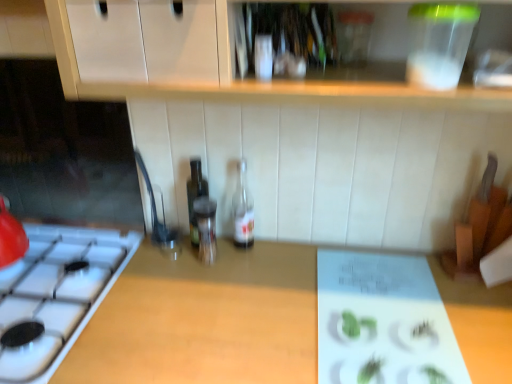
What do you see at coordinates (206, 228) in the screenshot? The image size is (512, 384). I see `transparent glass bottle at center, the 2th bottle positioned from the right` at bounding box center [206, 228].

The height and width of the screenshot is (384, 512). What do you see at coordinates (195, 196) in the screenshot?
I see `translucent glass bottle at center, the third bottle in the right-to-left sequence` at bounding box center [195, 196].

Locate an element on the screen. The height and width of the screenshot is (384, 512). transparent glass bottle at center, which is the 2th bottle from left to right is located at coordinates (206, 228).

In the scene shown: Can you confirm if transparent glass bottle at center, the 2th bottle positioned from the right, is positioned to the left of translucent glass bottle at center, arranged as the 1th bottle when viewed from the left?

In fact, transparent glass bottle at center, the 2th bottle positioned from the right, is to the right of translucent glass bottle at center, arranged as the 1th bottle when viewed from the left.

Which bottle is the 1st one when counting from the right side of the translucent glass bottle at center, arranged as the 1th bottle when viewed from the left? Please provide its 2D coordinates.

[(206, 228)]

Considering the relative sizes of transparent glass bottle at center, which is the 2th bottle from left to right, and translucent glass bottle at center, the third bottle in the right-to-left sequence, in the image provided, is transparent glass bottle at center, which is the 2th bottle from left to right, thinner than translucent glass bottle at center, the third bottle in the right-to-left sequence,?

Yes.

From a real-world perspective, is transparent glass bottle at center, which is the 2th bottle from left to right, above or below translucent glass bottle at center, arranged as the 1th bottle when viewed from the left?

Clearly, from a real-world perspective, transparent glass bottle at center, which is the 2th bottle from left to right, is below translucent glass bottle at center, arranged as the 1th bottle when viewed from the left.

Does translucent glass bottle at center, arranged as the 1th bottle when viewed from the left, appear on the left side of clear glass bottle at center, the first bottle positioned from the right?

Indeed, translucent glass bottle at center, arranged as the 1th bottle when viewed from the left, is positioned on the left side of clear glass bottle at center, the first bottle positioned from the right.

From a real-world perspective, between translucent glass bottle at center, the third bottle in the right-to-left sequence, and clear glass bottle at center, acting as the 3th bottle starting from the left, who is vertically lower?

From a 3D spatial view, translucent glass bottle at center, the third bottle in the right-to-left sequence, is below.

Is translucent glass bottle at center, the third bottle in the right-to-left sequence, wider than clear glass bottle at center, the first bottle positioned from the right?

In fact, translucent glass bottle at center, the third bottle in the right-to-left sequence, might be narrower than clear glass bottle at center, the first bottle positioned from the right.

Which is further, (196, 224) or (210, 243)?

Positioned behind is point (210, 243).

From the image's perspective, is translucent glass bottle at center, arranged as the 1th bottle when viewed from the left, positioned above or below transparent glass bottle at center, the 2th bottle positioned from the right?

Based on their image positions, translucent glass bottle at center, arranged as the 1th bottle when viewed from the left, is located above transparent glass bottle at center, the 2th bottle positioned from the right.

Measure the distance between translucent glass bottle at center, arranged as the 1th bottle when viewed from the left, and transparent glass bottle at center, which is the 2th bottle from left to right.

translucent glass bottle at center, arranged as the 1th bottle when viewed from the left, is 1.54 inches from transparent glass bottle at center, which is the 2th bottle from left to right.

Based on their positions, is translucent glass bottle at center, arranged as the 1th bottle when viewed from the left, located to the left or right of transparent glass bottle at center, the 2th bottle positioned from the right?

translucent glass bottle at center, arranged as the 1th bottle when viewed from the left, is to the left of transparent glass bottle at center, the 2th bottle positioned from the right.

At what (x,y) coordinates should I click in order to perform the action: click on the 1st bottle behind the wooden at center. Please return your answer as a coordinate pair (x, y). Looking at the image, I should click on pos(206,228).

Is transparent glass bottle at center, which is the 2th bottle from left to right, outside of wooden at center?

Yes, transparent glass bottle at center, which is the 2th bottle from left to right, is not within wooden at center.

Is transparent glass bottle at center, the 2th bottle positioned from the right, in front of or behind wooden at center in the image?

Visually, transparent glass bottle at center, the 2th bottle positioned from the right, is located behind wooden at center.

From a real-world perspective, is transparent glass bottle at center, which is the 2th bottle from left to right, positioned under wooden at center based on gravity?

No, from a real-world perspective, transparent glass bottle at center, which is the 2th bottle from left to right, is not under wooden at center.

Which of these two, clear glass bottle at center, the first bottle positioned from the right, or translucent glass bottle at center, arranged as the 1th bottle when viewed from the left, is bigger?

With larger size is translucent glass bottle at center, arranged as the 1th bottle when viewed from the left.

Consider the image. Does clear glass bottle at center, acting as the 3th bottle starting from the left, turn towards translucent glass bottle at center, arranged as the 1th bottle when viewed from the left?

No, clear glass bottle at center, acting as the 3th bottle starting from the left, is not oriented towards translucent glass bottle at center, arranged as the 1th bottle when viewed from the left.

Does clear glass bottle at center, acting as the 3th bottle starting from the left, appear on the right side of translucent glass bottle at center, the third bottle in the right-to-left sequence?

Correct, you'll find clear glass bottle at center, acting as the 3th bottle starting from the left, to the right of translucent glass bottle at center, the third bottle in the right-to-left sequence.

From the image's perspective, relative to translucent glass bottle at center, the third bottle in the right-to-left sequence, is clear glass bottle at center, the first bottle positioned from the right, above or below?

clear glass bottle at center, the first bottle positioned from the right, is situated higher than translucent glass bottle at center, the third bottle in the right-to-left sequence, in the image.

Is clear glass bottle at center, the first bottle positioned from the right, positioned with its back to transparent glass bottle at center, the 2th bottle positioned from the right?

clear glass bottle at center, the first bottle positioned from the right, is not turned away from transparent glass bottle at center, the 2th bottle positioned from the right.

Can you see clear glass bottle at center, acting as the 3th bottle starting from the left, touching transparent glass bottle at center, which is the 2th bottle from left to right?

No, clear glass bottle at center, acting as the 3th bottle starting from the left, is not making contact with transparent glass bottle at center, which is the 2th bottle from left to right.

Considering the positions of points (236, 209) and (205, 246), is point (236, 209) closer to camera compared to point (205, 246)?

No, (236, 209) is behind (205, 246).

Between clear glass bottle at center, the first bottle positioned from the right, and transparent glass bottle at center, the 2th bottle positioned from the right, which one has larger size?

With larger size is clear glass bottle at center, the first bottle positioned from the right.

Is clear glass bottle at center, the first bottle positioned from the right, looking in the opposite direction of wooden at center?

clear glass bottle at center, the first bottle positioned from the right, is not turned away from wooden at center.

Can you confirm if clear glass bottle at center, the first bottle positioned from the right, is positioned to the right of wooden at center?

In fact, clear glass bottle at center, the first bottle positioned from the right, is to the left of wooden at center.

Who is more distant, clear glass bottle at center, acting as the 3th bottle starting from the left, or wooden at center?

clear glass bottle at center, acting as the 3th bottle starting from the left, is further from the camera.

Find the location of a particular element. countertop below the clear glass bottle at center, the first bottle positioned from the right (from the image's perspective) is located at coordinates (193, 313).

The image size is (512, 384). I want to click on bottle lying on the left of transparent glass bottle at center, which is the 2th bottle from left to right, so click(x=195, y=196).

Starting from the translucent glass bottle at center, arranged as the 1th bottle when viewed from the left, which bottle is the 2nd one to the right? Please provide its 2D coordinates.

[(243, 210)]

Considering their positions, is wooden at center positioned closer to translucent glass bottle at center, the third bottle in the right-to-left sequence, than clear glass bottle at center, acting as the 3th bottle starting from the left?

Based on the image, clear glass bottle at center, acting as the 3th bottle starting from the left, appears to be nearer to translucent glass bottle at center, the third bottle in the right-to-left sequence.

Looking at the image, which one is located further to wooden at center, translucent glass bottle at center, arranged as the 1th bottle when viewed from the left, or clear glass bottle at center, the first bottle positioned from the right?

clear glass bottle at center, the first bottle positioned from the right, lies further to wooden at center than the other object.

When comparing their distances from transparent glass bottle at center, which is the 2th bottle from left to right, does clear glass bottle at center, the first bottle positioned from the right, or translucent glass bottle at center, the third bottle in the right-to-left sequence, seem closer?

Among the two, translucent glass bottle at center, the third bottle in the right-to-left sequence, is located nearer to transparent glass bottle at center, which is the 2th bottle from left to right.

From the image, which object appears to be farther from transparent glass bottle at center, which is the 2th bottle from left to right, wooden at center or translucent glass bottle at center, arranged as the 1th bottle when viewed from the left?

Among the two, wooden at center is located further to transparent glass bottle at center, which is the 2th bottle from left to right.

Which object lies further to the anchor point wooden at center, transparent glass bottle at center, which is the 2th bottle from left to right, or clear glass bottle at center, the first bottle positioned from the right?

clear glass bottle at center, the first bottle positioned from the right.

Considering their positions, is transparent glass bottle at center, which is the 2th bottle from left to right, positioned further to translucent glass bottle at center, the third bottle in the right-to-left sequence, than wooden at center?

wooden at center is positioned further to the anchor translucent glass bottle at center, the third bottle in the right-to-left sequence.

Based on their spatial positions, is translucent glass bottle at center, arranged as the 1th bottle when viewed from the left, or wooden at center further from transparent glass bottle at center, the 2th bottle positioned from the right?

wooden at center.

When comparing their distances from transparent glass bottle at center, the 2th bottle positioned from the right, does translucent glass bottle at center, the third bottle in the right-to-left sequence, or clear glass bottle at center, acting as the 3th bottle starting from the left, seem further?

The object further to transparent glass bottle at center, the 2th bottle positioned from the right, is clear glass bottle at center, acting as the 3th bottle starting from the left.

Image resolution: width=512 pixels, height=384 pixels. In order to click on bottle between translucent glass bottle at center, arranged as the 1th bottle when viewed from the left, and wooden at center, in the vertical direction in this screenshot , I will do `click(206, 228)`.

I want to click on bottle between translucent glass bottle at center, the third bottle in the right-to-left sequence, and clear glass bottle at center, the first bottle positioned from the right, so click(x=206, y=228).